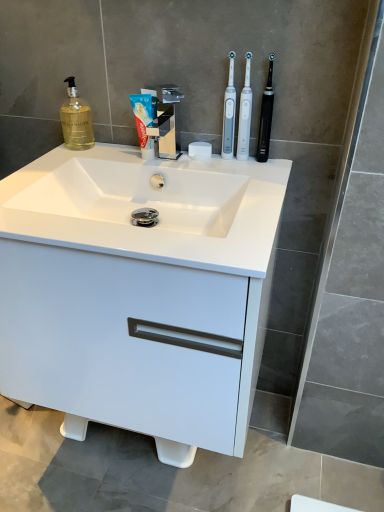
Locate an element on the screen. free space between white glossy toothpaste at center and translucent glass soap dispenser at upper left is located at coordinates click(x=112, y=151).